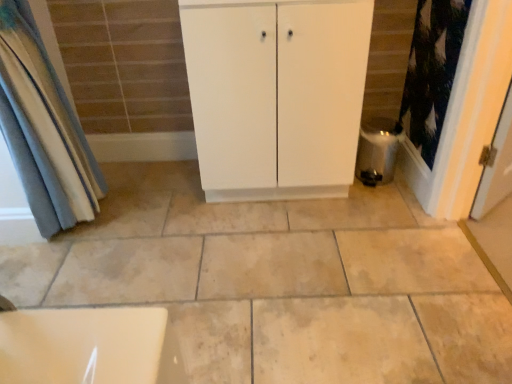
Where is `free location in front of blue fabric curtain at left`? This screenshot has height=384, width=512. free location in front of blue fabric curtain at left is located at coordinates pos(68,273).